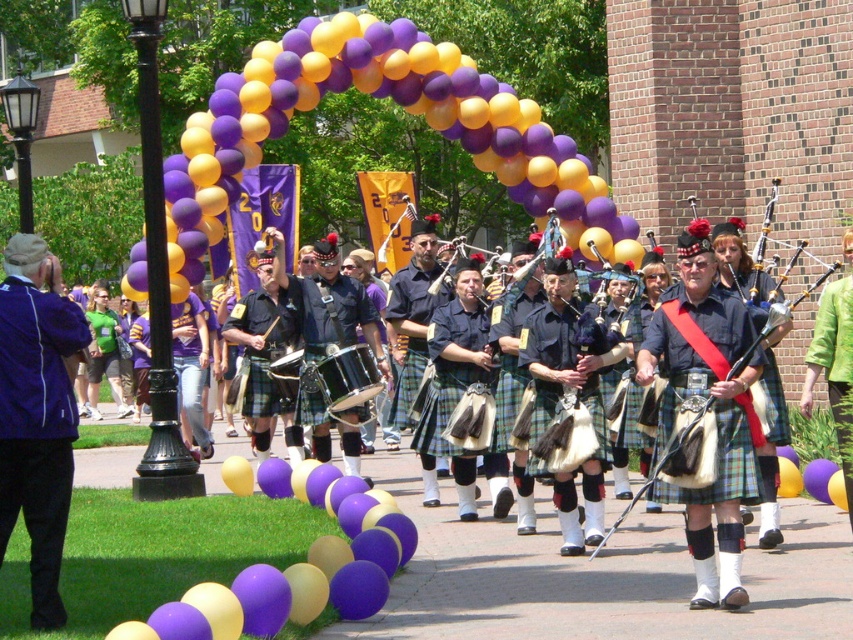
You are a photographer trying to capture the entire parade scene in one shot. You notice the purple fabric jacket at left and the shiny black drum at center. Which object should you focus on to ensure both are in frame without zooming in or out?

The purple fabric jacket at left is narrower than the shiny black drum at center. To capture both in frame, focus on the shiny black drum at center since it is wider and will help frame the scene appropriately.

You are a photographer at the parade and want to capture both the purple fabric jacket at left and the shiny black drum at center in a single photo. Which object should you place closer to the left edge of your camera frame to ensure both are visible?

The purple fabric jacket at left should be placed closer to the left edge of your camera frame since it is positioned on the left side of the shiny black drum at center, ensuring both are visible in the photo.